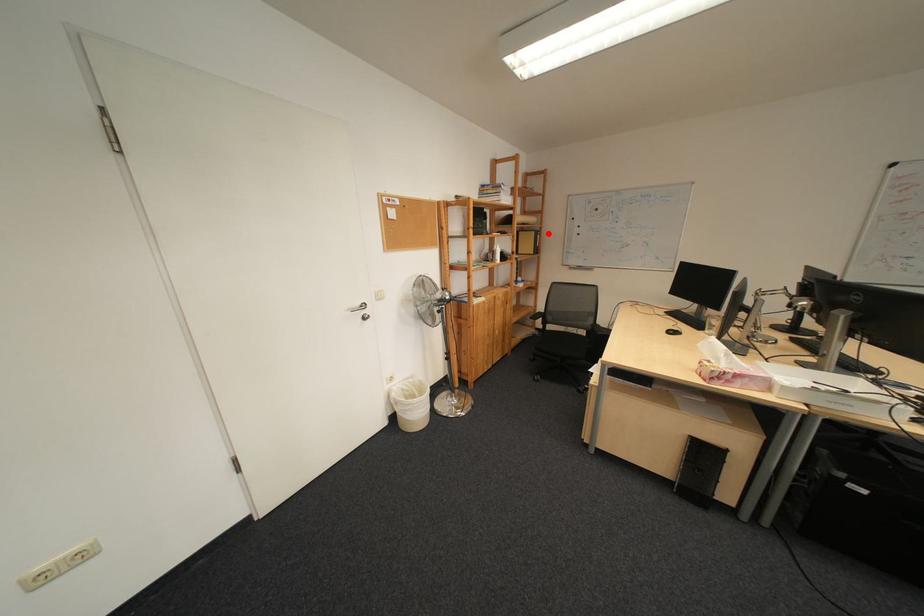
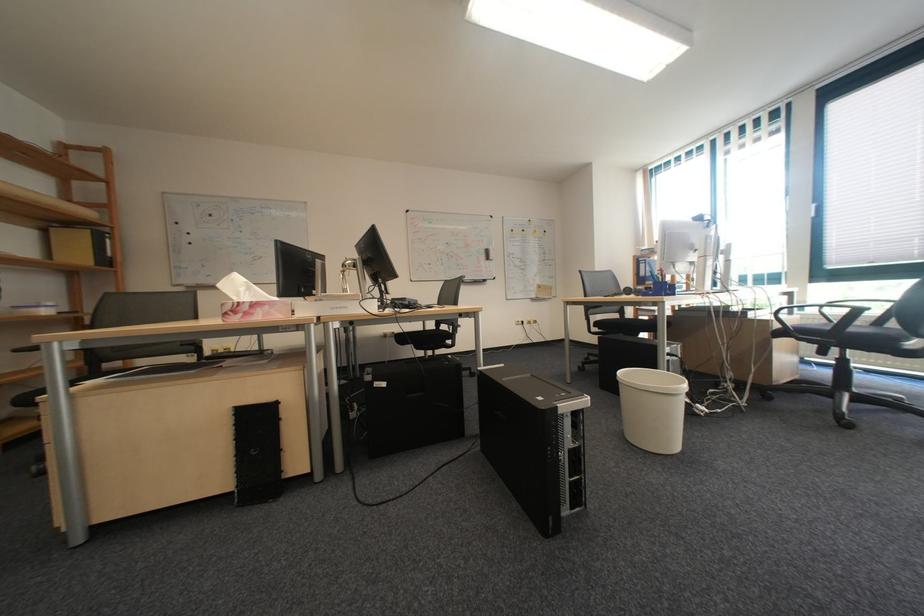
In the second image, find the point that corresponds to the highlighted location in the first image.

(103, 232)